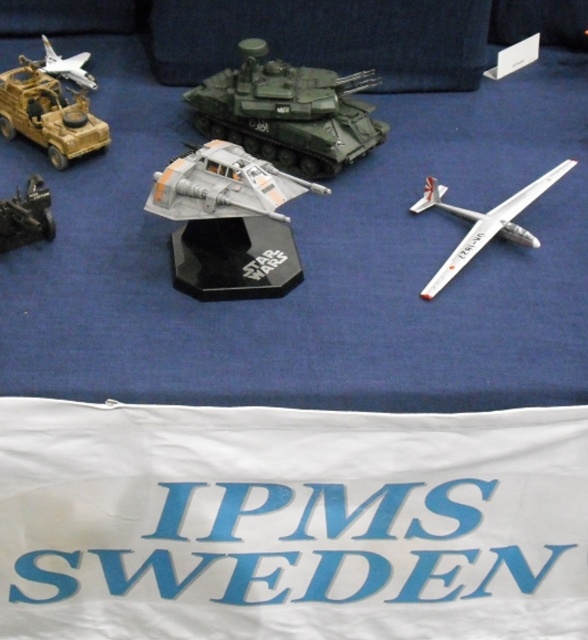
You are standing in front of the miniature model display. There are two points marked on the tablecloth at coordinates point (278, 120) and point (51, 237). Which point is closer to you?

Point (278, 120) is further to the viewer than point (51, 237), so the closer point to you is point (51, 237).

Looking at this image, you are a collector examining the miniature models on the blue tablecloth. You want to place a new model airplane between the green matte tank at center and the matte brown military vehicle at left. Can you fit it there without moving any existing models?

The green matte tank at center is in front of the matte brown military vehicle at left, so there is space between them where the new model airplane can be placed.